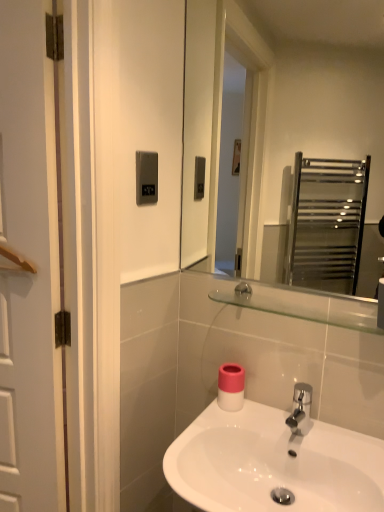
Identify the location of free spot below clear glass shelf at upper center (from a real-world perspective). (283, 424).